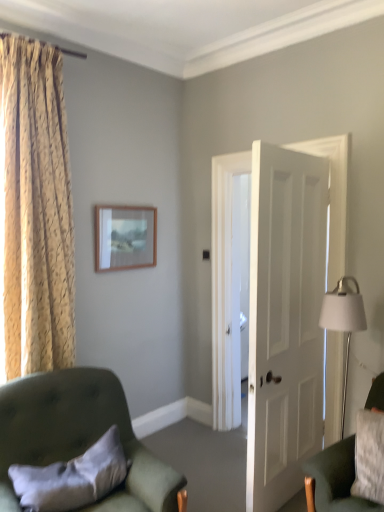
Question: Considering the relative sizes of velvet green armchair at lower left, positioned as the 1th chair in left-to-right order, and white matte door at center in the image provided, is velvet green armchair at lower left, positioned as the 1th chair in left-to-right order, wider than white matte door at center?

Choices:
 (A) yes
 (B) no

Answer: (A)

Question: Can you confirm if velvet green armchair at lower left, arranged as the 2th chair when viewed from the right, is taller than white matte door at center?

Choices:
 (A) no
 (B) yes

Answer: (A)

Question: Is velvet green armchair at lower left, positioned as the 1th chair in left-to-right order, aimed at white matte door at center?

Choices:
 (A) yes
 (B) no

Answer: (B)

Question: From a real-world perspective, does velvet green armchair at lower left, arranged as the 2th chair when viewed from the right, sit lower than white matte door at center?

Choices:
 (A) yes
 (B) no

Answer: (A)

Question: From a real-world perspective, is velvet green armchair at lower left, positioned as the 1th chair in left-to-right order, physically above white matte door at center?

Choices:
 (A) yes
 (B) no

Answer: (B)

Question: Does velvet green armchair at lower left, positioned as the 1th chair in left-to-right order, appear on the right side of white matte door at center?

Choices:
 (A) no
 (B) yes

Answer: (A)

Question: Considering the relative sizes of white matte door at center and velvet green armchair at lower right, the second chair when ordered from left to right, in the image provided, is white matte door at center bigger than velvet green armchair at lower right, the second chair when ordered from left to right,?

Choices:
 (A) yes
 (B) no

Answer: (A)

Question: Can velvet green armchair at lower right, arranged as the first chair when viewed from the right, be found inside white matte door at center?

Choices:
 (A) yes
 (B) no

Answer: (B)

Question: Can you confirm if white matte door at center is positioned to the right of velvet green armchair at lower right, the second chair when ordered from left to right?

Choices:
 (A) yes
 (B) no

Answer: (B)

Question: Would you consider white matte door at center to be distant from velvet green armchair at lower right, the second chair when ordered from left to right?

Choices:
 (A) yes
 (B) no

Answer: (A)

Question: Is white matte door at center turned away from velvet green armchair at lower right, arranged as the first chair when viewed from the right?

Choices:
 (A) no
 (B) yes

Answer: (B)

Question: Does white matte door at center come in front of velvet green armchair at lower right, arranged as the first chair when viewed from the right?

Choices:
 (A) yes
 (B) no

Answer: (B)

Question: Is gold textured curtain at left touching wooden picture frame at upper center?

Choices:
 (A) no
 (B) yes

Answer: (A)